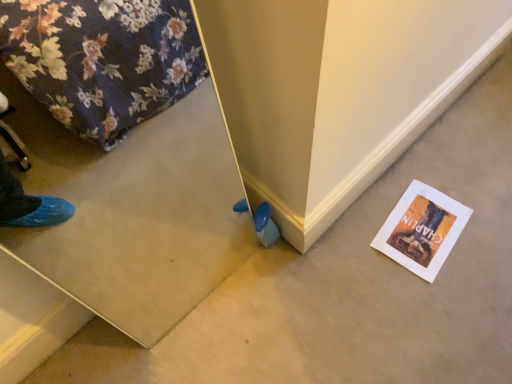
Where is `vacant space underneath white paper at lower right (from a real-world perspective)`? The width and height of the screenshot is (512, 384). vacant space underneath white paper at lower right (from a real-world perspective) is located at coordinates (419, 236).